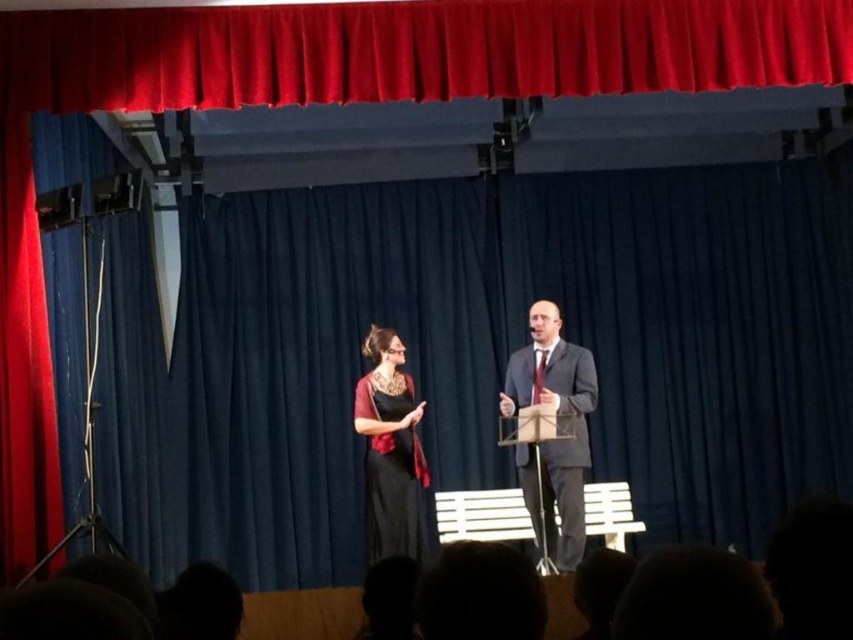
Question: Does matte black suit at center appear on the right side of black satin dress at center?

Choices:
 (A) no
 (B) yes

Answer: (B)

Question: Among these points, which one is farthest from the camera?

Choices:
 (A) (540, 531)
 (B) (381, 493)

Answer: (B)

Question: Which object is closer to the camera taking this photo?

Choices:
 (A) matte black suit at center
 (B) black satin dress at center

Answer: (A)

Question: Where is matte black suit at center located in relation to black satin dress at center in the image?

Choices:
 (A) below
 (B) above

Answer: (B)

Question: Is matte black suit at center further to the viewer compared to black satin dress at center?

Choices:
 (A) no
 (B) yes

Answer: (A)